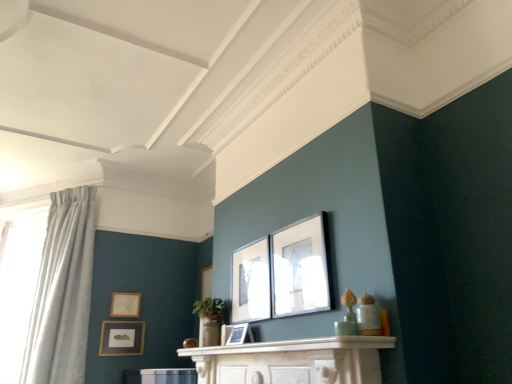
Find the location of a particular element. light blue fabric curtain at left is located at coordinates (62, 292).

The width and height of the screenshot is (512, 384). Describe the element at coordinates (251, 282) in the screenshot. I see `matte black picture frame at center, placed as the second picture frame when sorted from right to left` at that location.

What is the approximate height of matte black picture frame at center, which is the 2th picture frame from front to back?

21.10 inches.

The width and height of the screenshot is (512, 384). Identify the location of white marble mantle at center. (295, 345).

Is white sheer curtain at left placed right next to light blue fabric curtain at left?

No, white sheer curtain at left is not making contact with light blue fabric curtain at left.

Is white sheer curtain at left in front of or behind light blue fabric curtain at left in the image?

Visually, white sheer curtain at left is located behind light blue fabric curtain at left.

Considering the sizes of objects white sheer curtain at left and light blue fabric curtain at left in the image provided, who is bigger, white sheer curtain at left or light blue fabric curtain at left?

With larger size is light blue fabric curtain at left.

From the image's perspective, is white sheer curtain at left located above or below light blue fabric curtain at left?

white sheer curtain at left is situated lower than light blue fabric curtain at left in the image.

Is white sheer curtain at left at the left side of matte black picture frame at center, which is the 2th picture frame from front to back?

Yes.

Which is in front, point (9, 291) or point (234, 305)?

The point (234, 305) is closer to the camera.

Which is behind, white sheer curtain at left or matte black picture frame at center, which is the 4th picture frame in back-to-front order?

white sheer curtain at left is more distant.

From the picture: Is white sheer curtain at left positioned far away from matte black picture frame at center, which is the 2th picture frame from front to back?

white sheer curtain at left is positioned a significant distance from matte black picture frame at center, which is the 2th picture frame from front to back.

From a real-world perspective, is matte black picture frame at upper center, the 1th picture frame viewed from the right, physically located above or below light blue fabric curtain at left?

From a real-world perspective, matte black picture frame at upper center, the 1th picture frame viewed from the right, is physically below light blue fabric curtain at left.

Which object is positioned more to the left, matte black picture frame at upper center, positioned as the first picture frame in front-to-back order, or light blue fabric curtain at left?

light blue fabric curtain at left.

Is matte black picture frame at upper center, the 5th picture frame positioned from the back, further to the viewer compared to light blue fabric curtain at left?

No, it is not.

From the image's perspective, which one is positioned lower, matte gold picture frame at upper left, marked as the fifth picture frame in a front-to-back arrangement, or matte black picture frame at lower left, the fourth picture frame positioned from the front?

matte black picture frame at lower left, the fourth picture frame positioned from the front, appears lower in the image.

Which of these two, matte gold picture frame at upper left, which appears as the 1th picture frame when viewed from the back, or matte black picture frame at lower left, which is the second picture frame from left to right, is thinner?

With smaller width is matte black picture frame at lower left, which is the second picture frame from left to right.

The image size is (512, 384). I want to click on picture frame that is the 3rd one above the matte black picture frame at lower left, which is the second picture frame from left to right (from a real-world perspective), so click(125, 304).

In the image, is matte black picture frame at lower left, placed as the 4th picture frame when sorted from right to left, positioned in front of or behind white marble mantle at center?

Clearly, matte black picture frame at lower left, placed as the 4th picture frame when sorted from right to left, is behind white marble mantle at center.

Is matte black picture frame at lower left, the 2th picture frame when ordered from back to front, not near white marble mantle at center?

Yes, matte black picture frame at lower left, the 2th picture frame when ordered from back to front, is far from white marble mantle at center.

Who is shorter, matte black picture frame at lower left, which is the second picture frame from left to right, or white marble mantle at center?

Standing shorter between the two is white marble mantle at center.

Between matte black picture frame at lower left, the 2th picture frame when ordered from back to front, and white marble mantle at center, which one has larger width?

With larger width is white marble mantle at center.

Relative to matte black picture frame at lower left, the 2th picture frame when ordered from back to front, is matte black picture frame at center, the 3th picture frame in the front-to-back sequence, in front or behind?

Clearly, matte black picture frame at center, the 3th picture frame in the front-to-back sequence, is in front of matte black picture frame at lower left, the 2th picture frame when ordered from back to front.

Is matte black picture frame at lower left, which is the second picture frame from left to right, at the back of matte black picture frame at center, the third picture frame when ordered from right to left?

No, matte black picture frame at center, the third picture frame when ordered from right to left, is not facing away from matte black picture frame at lower left, which is the second picture frame from left to right.

Is matte black picture frame at center, the 3th picture frame in the front-to-back sequence, bigger than matte black picture frame at lower left, the fourth picture frame positioned from the front?

Incorrect, matte black picture frame at center, the 3th picture frame in the front-to-back sequence, is not larger than matte black picture frame at lower left, the fourth picture frame positioned from the front.

From the image's perspective, is matte black picture frame at center, which ranks as the 3th picture frame in left-to-right order, above or below matte black picture frame at lower left, the fourth picture frame positioned from the front?

matte black picture frame at center, which ranks as the 3th picture frame in left-to-right order, is situated higher than matte black picture frame at lower left, the fourth picture frame positioned from the front, in the image.

Considering the relative sizes of light blue fabric curtain at left and matte gold picture frame at upper left, which appears as the 1th picture frame when viewed from the back, in the image provided, is light blue fabric curtain at left bigger than matte gold picture frame at upper left, which appears as the 1th picture frame when viewed from the back,?

Yes.

Which object is positioned more to the left, light blue fabric curtain at left or matte gold picture frame at upper left, which is the fifth picture frame from right to left?

light blue fabric curtain at left is more to the left.

Is light blue fabric curtain at left inside the boundaries of matte gold picture frame at upper left, marked as the fifth picture frame in a front-to-back arrangement, or outside?

light blue fabric curtain at left is outside matte gold picture frame at upper left, marked as the fifth picture frame in a front-to-back arrangement.

Locate an element on the screen. curtain in front of the white sheer curtain at left is located at coordinates (62, 292).

From the image's perspective, which picture frame is the 2nd one above the white sheer curtain at left? Please provide its 2D coordinates.

[(251, 282)]

Looking at the image, which one is located further to matte black picture frame at center, placed as the second picture frame when sorted from right to left, matte black picture frame at upper center, the 1th picture frame viewed from the right, or matte black picture frame at lower left, which is the second picture frame from left to right?

matte black picture frame at lower left, which is the second picture frame from left to right.

Which object lies nearer to the anchor point matte black picture frame at lower left, the 2th picture frame when ordered from back to front, light blue fabric curtain at left or matte black picture frame at upper center, placed as the fifth picture frame when sorted from left to right?

light blue fabric curtain at left lies closer to matte black picture frame at lower left, the 2th picture frame when ordered from back to front, than the other object.

Based on the photo, based on their spatial positions, is white marble mantle at center or matte black picture frame at center, which ranks as the 3th picture frame in left-to-right order, closer to light blue fabric curtain at left?

The object closer to light blue fabric curtain at left is white marble mantle at center.

When comparing their distances from matte gold picture frame at upper left, which appears as the 1th picture frame when viewed from the back, does light blue fabric curtain at left or matte black picture frame at center, the fourth picture frame when ordered from left to right, seem further?

matte black picture frame at center, the fourth picture frame when ordered from left to right.

From the image, which object appears to be nearer to white sheer curtain at left, matte black picture frame at center, arranged as the 3th picture frame when viewed from the back, or light blue fabric curtain at left?

light blue fabric curtain at left lies closer to white sheer curtain at left than the other object.

Which object lies nearer to the anchor point white marble mantle at center, matte gold picture frame at upper left, marked as the fifth picture frame in a front-to-back arrangement, or light blue fabric curtain at left?

light blue fabric curtain at left lies closer to white marble mantle at center than the other object.

Based on their spatial positions, is matte black picture frame at lower left, placed as the 4th picture frame when sorted from right to left, or matte black picture frame at center, the third picture frame when ordered from right to left, closer to matte black picture frame at center, which is the 2th picture frame from front to back?

matte black picture frame at center, the third picture frame when ordered from right to left, is positioned closer to the anchor matte black picture frame at center, which is the 2th picture frame from front to back.

From the image, which object appears to be nearer to matte gold picture frame at upper left, which appears as the 1th picture frame when viewed from the back, matte black picture frame at lower left, the fourth picture frame positioned from the front, or matte black picture frame at center, the third picture frame when ordered from right to left?

Based on the image, matte black picture frame at lower left, the fourth picture frame positioned from the front, appears to be nearer to matte gold picture frame at upper left, which appears as the 1th picture frame when viewed from the back.

Identify the location of curtain positioned between white marble mantle at center and matte gold picture frame at upper left, the first picture frame when ordered from left to right, from near to far. (62, 292).

Image resolution: width=512 pixels, height=384 pixels. Find the location of `curtain between white sheer curtain at left and matte gold picture frame at upper left, which appears as the 1th picture frame when viewed from the back`. curtain between white sheer curtain at left and matte gold picture frame at upper left, which appears as the 1th picture frame when viewed from the back is located at coordinates (62, 292).

Where is `curtain between white sheer curtain at left and matte black picture frame at lower left, the 2th picture frame when ordered from back to front`? The height and width of the screenshot is (384, 512). curtain between white sheer curtain at left and matte black picture frame at lower left, the 2th picture frame when ordered from back to front is located at coordinates (62, 292).

Locate an element on the screen. Image resolution: width=512 pixels, height=384 pixels. picture frame between matte black picture frame at center, which ranks as the 3th picture frame in left-to-right order, and matte gold picture frame at upper left, which is the fifth picture frame from right to left, from front to back is located at coordinates (122, 338).